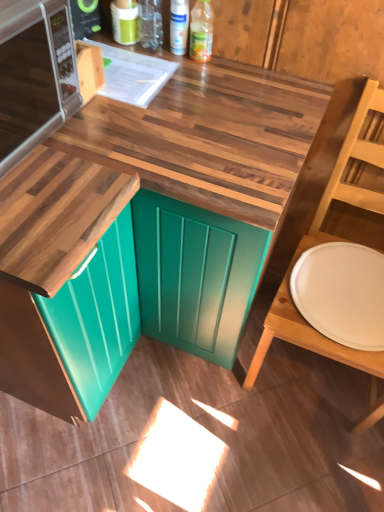
This screenshot has height=512, width=384. In order to click on free region under wooden chair at right (from a real-world perspective) in this screenshot , I will do `click(303, 374)`.